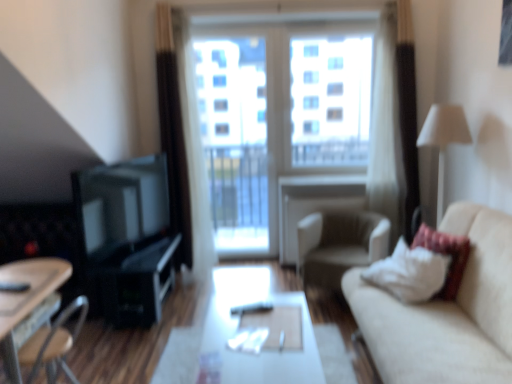
Question: Is matte black entertainment center at left at the right side of wooden table at lower left, arranged as the first table when viewed from the left?

Choices:
 (A) yes
 (B) no

Answer: (A)

Question: Is matte black entertainment center at left positioned far away from wooden table at lower left, the second table when ordered from right to left?

Choices:
 (A) no
 (B) yes

Answer: (A)

Question: Is matte black entertainment center at left wider than wooden table at lower left, arranged as the first table when viewed from the left?

Choices:
 (A) yes
 (B) no

Answer: (B)

Question: Is matte black entertainment center at left at the left side of wooden table at lower left, the second table when ordered from right to left?

Choices:
 (A) no
 (B) yes

Answer: (A)

Question: Is matte black entertainment center at left looking in the opposite direction of wooden table at lower left, arranged as the first table when viewed from the left?

Choices:
 (A) no
 (B) yes

Answer: (A)

Question: Looking at their shapes, would you say matte black entertainment center at left is wider or thinner than white soft pillow at right?

Choices:
 (A) thin
 (B) wide

Answer: (A)

Question: From the image's perspective, is matte black entertainment center at left positioned above or below white soft pillow at right?

Choices:
 (A) below
 (B) above

Answer: (B)

Question: Considering the relative positions of matte black entertainment center at left and white soft pillow at right in the image provided, is matte black entertainment center at left to the left or to the right of white soft pillow at right?

Choices:
 (A) right
 (B) left

Answer: (B)

Question: From a real-world perspective, relative to white soft pillow at right, is matte black entertainment center at left vertically above or below?

Choices:
 (A) below
 (B) above

Answer: (B)

Question: In the image, is transparent glass window at center on the left side or the right side of matte black entertainment center at left?

Choices:
 (A) left
 (B) right

Answer: (B)

Question: From the image's perspective, relative to matte black entertainment center at left, is transparent glass window at center above or below?

Choices:
 (A) below
 (B) above

Answer: (B)

Question: Does point (313, 150) appear closer or farther from the camera than point (105, 299)?

Choices:
 (A) closer
 (B) farther

Answer: (B)

Question: From a real-world perspective, is transparent glass window at center positioned above or below matte black entertainment center at left?

Choices:
 (A) above
 (B) below

Answer: (A)

Question: Is matte black entertainment center at left situated inside beige fabric couch at right or outside?

Choices:
 (A) inside
 (B) outside

Answer: (B)

Question: Considering the positions of point (100, 256) and point (400, 304), is point (100, 256) closer or farther from the camera than point (400, 304)?

Choices:
 (A) farther
 (B) closer

Answer: (A)